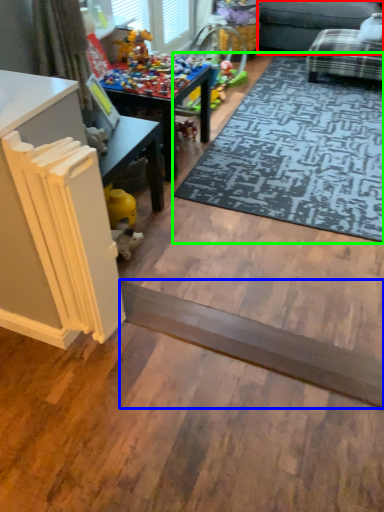
Question: Which object is the closest to the couch (highlighted by a red box)? Choose among these: plank (highlighted by a blue box) or mat (highlighted by a green box).

Choices:
 (A) plank
 (B) mat

Answer: (B)